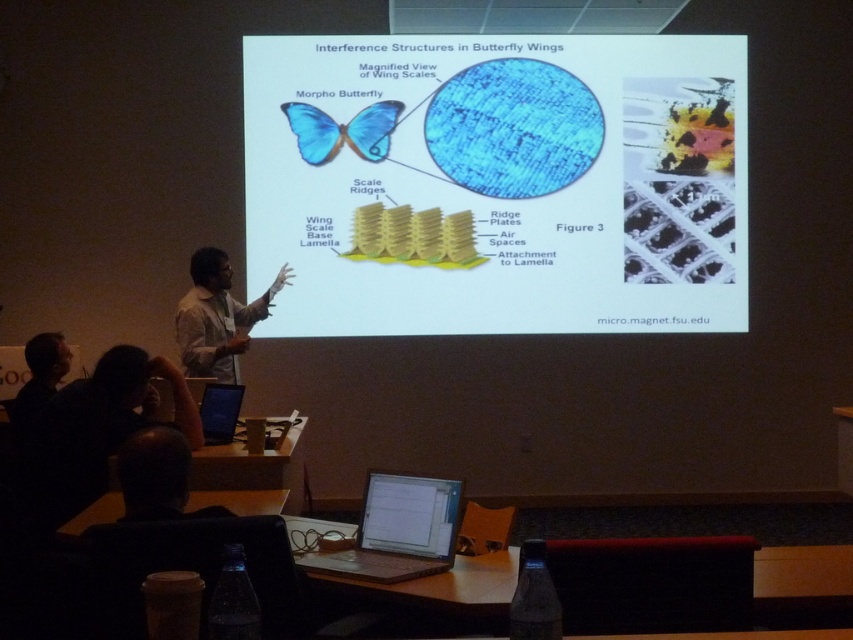
Can you confirm if blue glossy butterfly wing at center is thinner than dark hair at lower left?

No.

Does point (646, 180) lie behind point (22, 388)?

Yes, it is.

Between point (277, 230) and point (38, 353), which one is positioned behind?

The point (277, 230) is behind.

Where is `blue glossy butterfly wing at center`? The height and width of the screenshot is (640, 853). blue glossy butterfly wing at center is located at coordinates (498, 182).

Is satin silver laptop at lower center to the left of blue matte laptop at lower left from the viewer's perspective?

No, satin silver laptop at lower center is not to the left of blue matte laptop at lower left.

Is satin silver laptop at lower center bigger than blue matte laptop at lower left?

Indeed, satin silver laptop at lower center has a larger size compared to blue matte laptop at lower left.

This screenshot has height=640, width=853. I want to click on satin silver laptop at lower center, so click(397, 531).

Is point (503, 81) farther from camera compared to point (209, 387)?

Yes, point (503, 81) is behind point (209, 387).

Can you confirm if blue glossy butterfly wing at center is smaller than blue matte laptop at lower left?

No.

Find the location of a particular element. The image size is (853, 640). blue glossy butterfly wing at center is located at coordinates (498, 182).